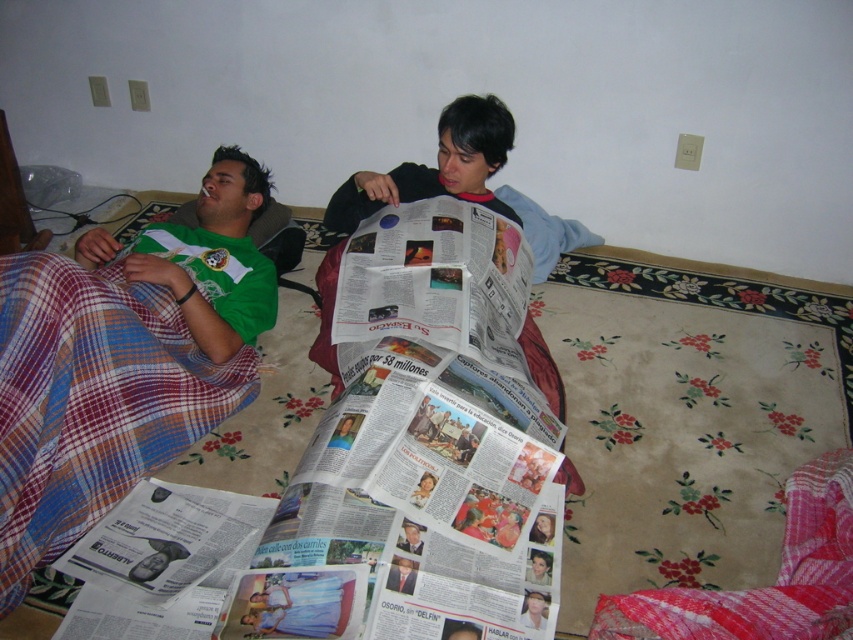
Question: From the image, what is the correct spatial relationship of plaid fabric blanket at lower left in relation to plaid fabric blanket at lower right?

Choices:
 (A) right
 (B) left

Answer: (B)

Question: Which of these objects is positioned farthest from the plaid fabric blanket at lower right?

Choices:
 (A) plaid fabric blanket at lower left
 (B) green jersey at left
 (C) printed paper newspaper at center

Answer: (B)

Question: From the image, what is the correct spatial relationship of plaid fabric blanket at lower left in relation to plaid fabric blanket at lower right?

Choices:
 (A) above
 (B) below

Answer: (A)

Question: Does plaid fabric blanket at lower right have a lesser width compared to printed paper newspaper at center?

Choices:
 (A) no
 (B) yes

Answer: (A)

Question: Which of the following is the farthest from the observer?

Choices:
 (A) (695, 608)
 (B) (163, 224)
 (C) (3, 333)

Answer: (B)

Question: Which object is positioned farthest from the plaid fabric blanket at lower right?

Choices:
 (A) plaid fabric blanket at lower left
 (B) green jersey at left

Answer: (B)